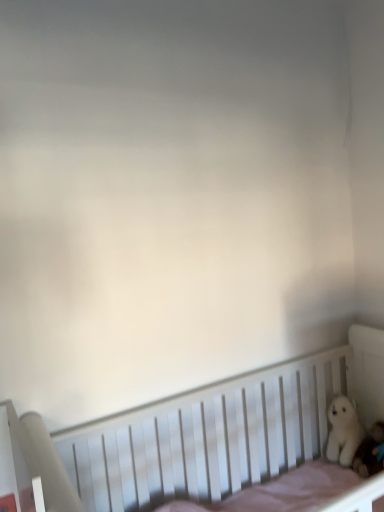
What is the approximate height of white plush toy at lower right, marked as the first toy in a front-to-back arrangement?

The height of white plush toy at lower right, marked as the first toy in a front-to-back arrangement, is 9.65 inches.

This screenshot has width=384, height=512. What do you see at coordinates (343, 431) in the screenshot? I see `white plush bear at right, acting as the second toy starting from the front` at bounding box center [343, 431].

Identify the location of white wooden crib at lower right. (221, 430).

Can you confirm if white plush toy at lower right, acting as the second toy starting from the back, is thinner than white plush bear at right, positioned as the first toy in back-to-front order?

Correct, the width of white plush toy at lower right, acting as the second toy starting from the back, is less than that of white plush bear at right, positioned as the first toy in back-to-front order.

Consider the image. From a real-world perspective, is white plush toy at lower right, marked as the first toy in a front-to-back arrangement, located higher than white plush bear at right, positioned as the first toy in back-to-front order?

No, from a real-world perspective, white plush toy at lower right, marked as the first toy in a front-to-back arrangement, is not above white plush bear at right, positioned as the first toy in back-to-front order.

Is point (353, 459) more distant than point (353, 439)?

No.

Does white plush toy at lower right, acting as the second toy starting from the back, come behind white plush bear at right, positioned as the first toy in back-to-front order?

No, white plush toy at lower right, acting as the second toy starting from the back, is in front of white plush bear at right, positioned as the first toy in back-to-front order.

Is white plush toy at lower right, acting as the second toy starting from the back, directly adjacent to white wooden crib at lower right?

They are not placed beside each other.

Between white plush toy at lower right, acting as the second toy starting from the back, and white wooden crib at lower right, which one has smaller size?

white plush toy at lower right, acting as the second toy starting from the back, is smaller.

Considering the positions of objects white plush toy at lower right, marked as the first toy in a front-to-back arrangement, and white wooden crib at lower right in the image provided, who is in front, white plush toy at lower right, marked as the first toy in a front-to-back arrangement, or white wooden crib at lower right?

Positioned in front is white wooden crib at lower right.

From a real-world perspective, is white plush toy at lower right, acting as the second toy starting from the back, on top of white wooden crib at lower right?

Indeed, from a real-world perspective, white plush toy at lower right, acting as the second toy starting from the back, stands above white wooden crib at lower right.

Is point (277, 462) closer to viewer compared to point (352, 467)?

No.

Consider the image. Is white wooden crib at lower right directly adjacent to white plush toy at lower right, marked as the first toy in a front-to-back arrangement?

No, white wooden crib at lower right is not beside white plush toy at lower right, marked as the first toy in a front-to-back arrangement.

Does white wooden crib at lower right have a greater width compared to white plush toy at lower right, marked as the first toy in a front-to-back arrangement?

Correct, the width of white wooden crib at lower right exceeds that of white plush toy at lower right, marked as the first toy in a front-to-back arrangement.

Looking at this image, how many degrees apart are the facing directions of white wooden crib at lower right and white plush toy at lower right, marked as the first toy in a front-to-back arrangement?

The facing directions of white wooden crib at lower right and white plush toy at lower right, marked as the first toy in a front-to-back arrangement, are 88 degrees apart.

From a real-world perspective, relative to white plush bear at right, positioned as the first toy in back-to-front order, is white wooden crib at lower right vertically above or below?

white wooden crib at lower right is situated lower than white plush bear at right, positioned as the first toy in back-to-front order, in the real world.

How much distance is there between white wooden crib at lower right and white plush bear at right, acting as the second toy starting from the front?

white wooden crib at lower right is 15.96 inches away from white plush bear at right, acting as the second toy starting from the front.

Identify the location of the 2nd toy located above the white wooden crib at lower right (from a real-world perspective). (343, 431).

Is white wooden crib at lower right not close to white plush bear at right, positioned as the first toy in back-to-front order?

No, white wooden crib at lower right is not far away from white plush bear at right, positioned as the first toy in back-to-front order.

In terms of width, does white plush bear at right, positioned as the first toy in back-to-front order, look wider or thinner when compared to white wooden crib at lower right?

Considering their sizes, white plush bear at right, positioned as the first toy in back-to-front order, looks slimmer than white wooden crib at lower right.

Is white plush bear at right, acting as the second toy starting from the front, not close to white wooden crib at lower right?

white plush bear at right, acting as the second toy starting from the front, is actually quite close to white wooden crib at lower right.

Is white plush bear at right, positioned as the first toy in back-to-front order, turned away from white wooden crib at lower right?

Correct, white plush bear at right, positioned as the first toy in back-to-front order, is looking away from white wooden crib at lower right.

From the image's perspective, which is below, white plush bear at right, acting as the second toy starting from the front, or white plush toy at lower right, marked as the first toy in a front-to-back arrangement?

From the image's view, white plush toy at lower right, marked as the first toy in a front-to-back arrangement, is below.

Does white plush bear at right, acting as the second toy starting from the front, come behind white plush toy at lower right, acting as the second toy starting from the back?

Yes, white plush bear at right, acting as the second toy starting from the front, is further from the viewer.

Is white plush toy at lower right, acting as the second toy starting from the back, surrounded by white plush bear at right, acting as the second toy starting from the front?

No, white plush toy at lower right, acting as the second toy starting from the back, is located outside of white plush bear at right, acting as the second toy starting from the front.

This screenshot has width=384, height=512. I want to click on toy behind the white plush toy at lower right, marked as the first toy in a front-to-back arrangement, so click(343, 431).

Locate an element on the screen. The height and width of the screenshot is (512, 384). infant bed lying below the white plush toy at lower right, acting as the second toy starting from the back (from the image's perspective) is located at coordinates (221, 430).

Based on their spatial positions, is white plush bear at right, acting as the second toy starting from the front, or white wooden crib at lower right further from white plush toy at lower right, acting as the second toy starting from the back?

white wooden crib at lower right is positioned further to the anchor white plush toy at lower right, acting as the second toy starting from the back.

When comparing their distances from white plush toy at lower right, acting as the second toy starting from the back, does white wooden crib at lower right or white plush bear at right, positioned as the first toy in back-to-front order, seem closer?

Among the two, white plush bear at right, positioned as the first toy in back-to-front order, is located nearer to white plush toy at lower right, acting as the second toy starting from the back.

From the image, which object appears to be farther from white wooden crib at lower right, white plush toy at lower right, acting as the second toy starting from the back, or white plush bear at right, acting as the second toy starting from the front?

Based on the image, white plush toy at lower right, acting as the second toy starting from the back, appears to be further to white wooden crib at lower right.

Based on the photo, considering their positions, is white plush bear at right, positioned as the first toy in back-to-front order, positioned closer to white wooden crib at lower right than white plush toy at lower right, acting as the second toy starting from the back?

white plush bear at right, positioned as the first toy in back-to-front order, lies closer to white wooden crib at lower right than the other object.

From the image, which object appears to be farther from white plush bear at right, acting as the second toy starting from the front, white wooden crib at lower right or white plush toy at lower right, marked as the first toy in a front-to-back arrangement?

white wooden crib at lower right lies further to white plush bear at right, acting as the second toy starting from the front, than the other object.

Considering their positions, is white plush toy at lower right, acting as the second toy starting from the back, positioned closer to white plush bear at right, positioned as the first toy in back-to-front order, than white wooden crib at lower right?

white plush toy at lower right, acting as the second toy starting from the back, is closer to white plush bear at right, positioned as the first toy in back-to-front order.

You are a GUI agent. You are given a task and a screenshot of the screen. Output one action in this format:
    pyautogui.click(x=<x>, y=<y>)
    Task: Click on the toy between white wooden crib at lower right and white plush bear at right, positioned as the first toy in back-to-front order, along the z-axis
    
    Given the screenshot: What is the action you would take?
    pyautogui.click(x=370, y=452)